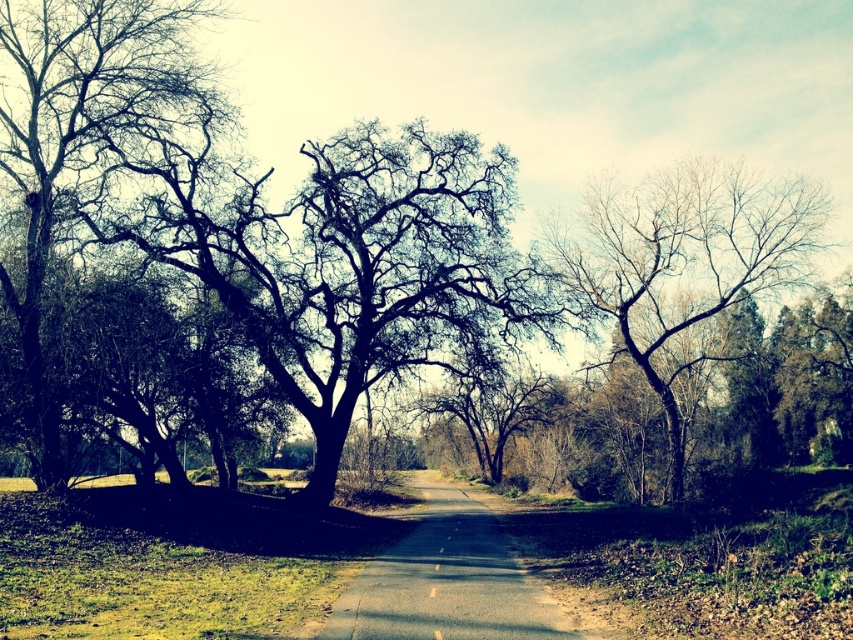
Which of these two, dark brown bark tree at center or dark green textured tree at left, stands shorter?

With less height is dark brown bark tree at center.

Is dark brown bark tree at center positioned at the back of dark green textured tree at left?

Yes, dark brown bark tree at center is behind dark green textured tree at left.

What do you see at coordinates (373, 272) in the screenshot?
I see `dark brown bark tree at center` at bounding box center [373, 272].

You are a GUI agent. You are given a task and a screenshot of the screen. Output one action in this format:
    pyautogui.click(x=<x>, y=<y>)
    Task: Click on the dark brown bark tree at center
    The width and height of the screenshot is (853, 640).
    Given the screenshot: What is the action you would take?
    pyautogui.click(x=373, y=272)

Is dark brown bark tree at center to the left of bare branches at right from the viewer's perspective?

Correct, you'll find dark brown bark tree at center to the left of bare branches at right.

Is point (334, 332) farther from viewer compared to point (683, 326)?

That is False.

The image size is (853, 640). Find the location of `dark brown bark tree at center`. dark brown bark tree at center is located at coordinates (373, 272).

Does dark green textured tree at left have a larger size compared to bare branches at right?

Actually, dark green textured tree at left might be smaller than bare branches at right.

Image resolution: width=853 pixels, height=640 pixels. I want to click on dark green textured tree at left, so click(x=76, y=138).

Does point (18, 259) come behind point (672, 196)?

No, it is in front of (672, 196).

This screenshot has height=640, width=853. I want to click on dark green textured tree at left, so click(76, 138).